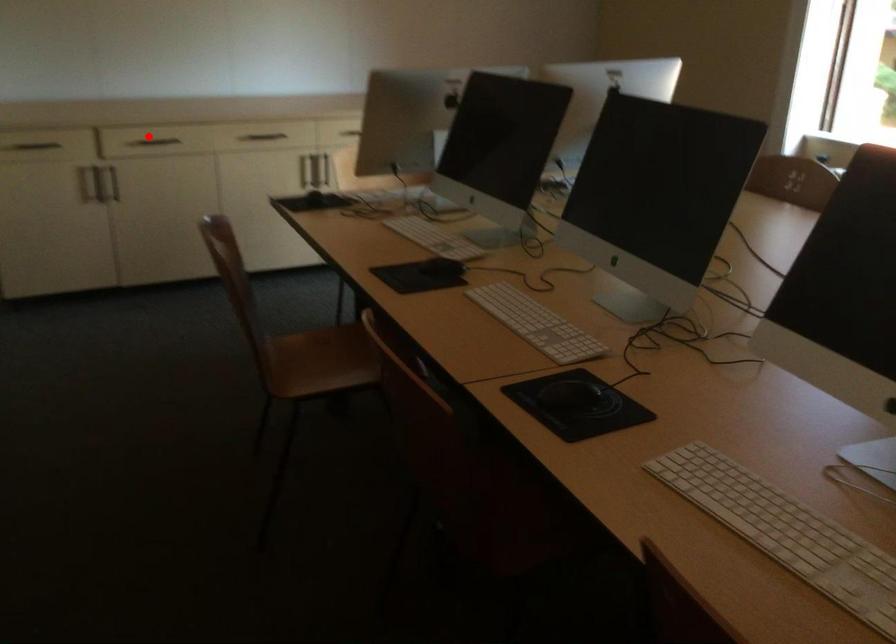
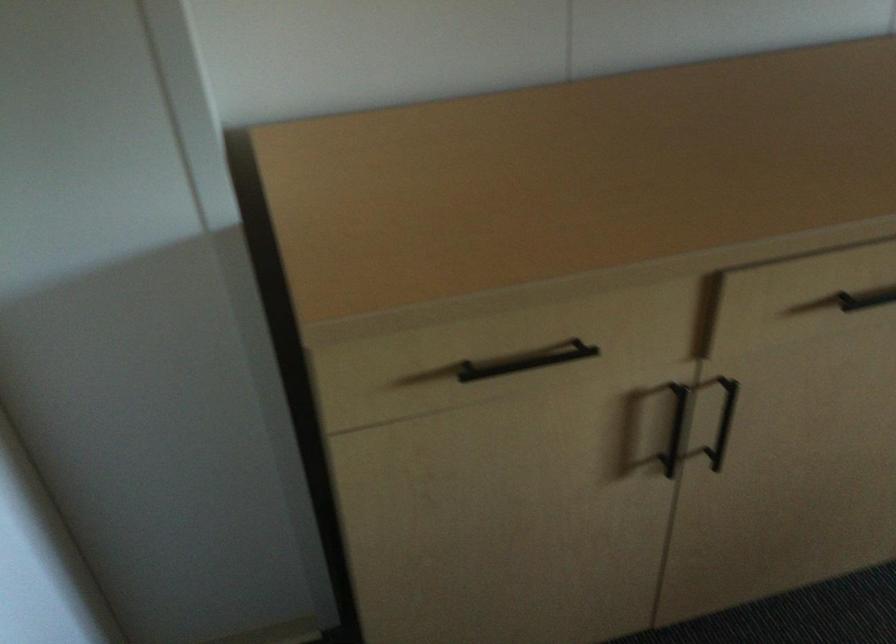
Question: I am providing you with two images of the same scene from different viewpoints. Given a red point in image1, look at the same physical point in image2. Is it:

Choices:
 (A) Closer to the viewpoint
 (B) Farther from the viewpoint

Answer: (A)